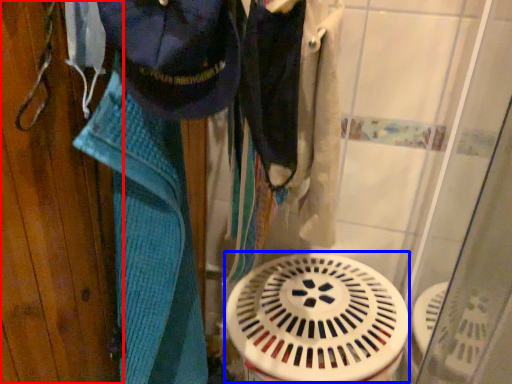
Question: Which object is further to the camera taking this photo, door (highlighted by a red box) or water heater (highlighted by a blue box)?

Choices:
 (A) door
 (B) water heater

Answer: (B)